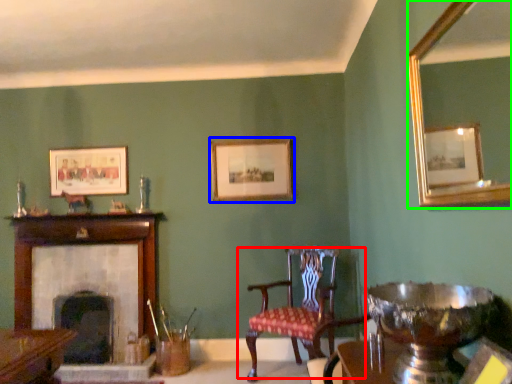
Question: Estimate the real-world distances between objects in this image. Which object is farther from chair (highlighted by a red box), picture frame (highlighted by a blue box) or mirror (highlighted by a green box)?

Choices:
 (A) picture frame
 (B) mirror

Answer: (B)